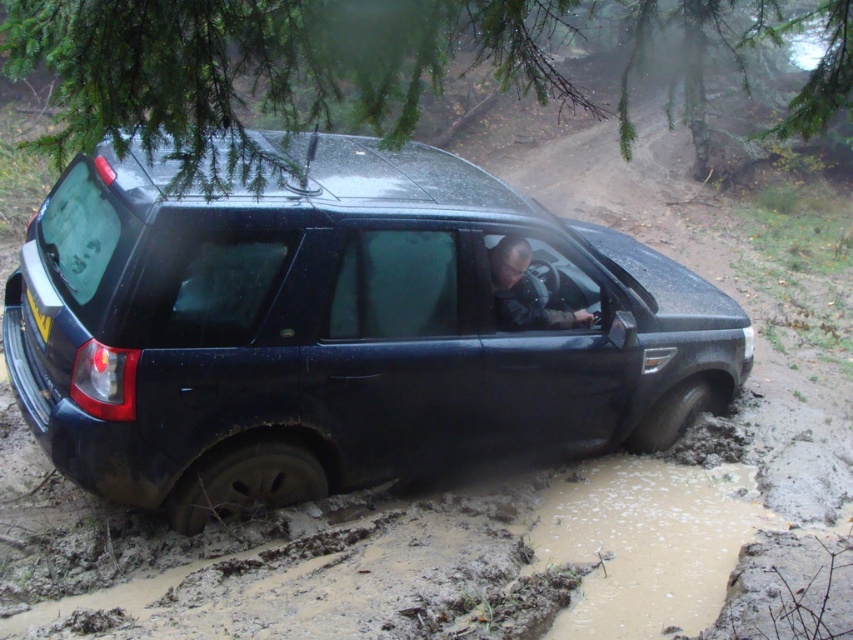
Can you confirm if brown muddy puddle at lower center is positioned below yellow matte license plate at rear?

Yes.

Based on the photo, who is shorter, brown muddy puddle at lower center or yellow matte license plate at rear?

yellow matte license plate at rear

Between point (772, 522) and point (30, 301), which one is positioned behind?

Point (772, 522)

What are the coordinates of `brown muddy puddle at lower center` in the screenshot? It's located at 647,544.

Based on the photo, is glossy black suv at center positioned at the back of dark gray fabric jacket at center?

That is False.

Is glossy black suv at center to the left of dark gray fabric jacket at center from the viewer's perspective?

Indeed, glossy black suv at center is positioned on the left side of dark gray fabric jacket at center.

The width and height of the screenshot is (853, 640). In order to click on glossy black suv at center in this screenshot , I will do `click(338, 330)`.

Identify the location of glossy black suv at center. (338, 330).

Who is more distant from viewer, (177, 468) or (686, 541)?

Positioned behind is point (686, 541).

The height and width of the screenshot is (640, 853). What do you see at coordinates (338, 330) in the screenshot?
I see `glossy black suv at center` at bounding box center [338, 330].

Is point (263, 266) farther from viewer compared to point (610, 600)?

No, (263, 266) is in front of (610, 600).

Locate an element on the screen. glossy black suv at center is located at coordinates (338, 330).